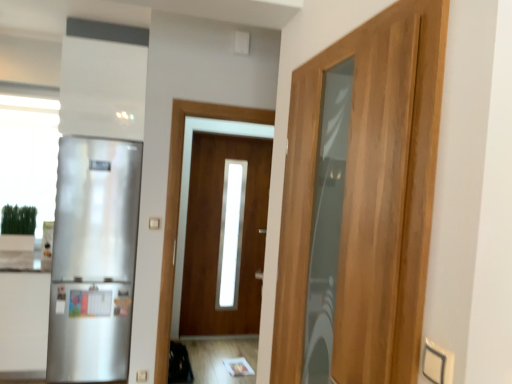
Question: Should I look upward or downward to see satin white cabinet at left?

Choices:
 (A) down
 (B) up

Answer: (A)

Question: Is the depth of satin silver refrigerator at left greater than that of wooden door at center, acting as the second door starting from the right?

Choices:
 (A) yes
 (B) no

Answer: (B)

Question: From the image's perspective, is satin silver refrigerator at left above wooden door at center, the second door when ordered from front to back?

Choices:
 (A) yes
 (B) no

Answer: (B)

Question: Is wooden door at center, the second door when ordered from front to back, at the back of satin silver refrigerator at left?

Choices:
 (A) yes
 (B) no

Answer: (B)

Question: Does satin silver refrigerator at left turn towards wooden door at center, the second door when ordered from front to back?

Choices:
 (A) no
 (B) yes

Answer: (A)

Question: From the image's perspective, is satin silver refrigerator at left located beneath wooden door at center, the 1th door positioned from the left?

Choices:
 (A) yes
 (B) no

Answer: (A)

Question: Is satin silver refrigerator at left wider than wooden door at center, which is counted as the first door, starting from the back?

Choices:
 (A) no
 (B) yes

Answer: (B)

Question: From the image's perspective, is wooden door at center, which is counted as the first door, starting from the back, above satin white cabinet at left?

Choices:
 (A) no
 (B) yes

Answer: (B)

Question: Can you confirm if wooden door at center, which is counted as the first door, starting from the back, is thinner than satin white cabinet at left?

Choices:
 (A) yes
 (B) no

Answer: (A)

Question: Is wooden door at center, the 1th door positioned from the left, further to camera compared to satin white cabinet at left?

Choices:
 (A) no
 (B) yes

Answer: (B)

Question: Considering the relative positions of wooden door at center, the second door when ordered from front to back, and satin white cabinet at left in the image provided, is wooden door at center, the second door when ordered from front to back, to the left of satin white cabinet at left from the viewer's perspective?

Choices:
 (A) yes
 (B) no

Answer: (B)

Question: Is wooden door at center, the second door when ordered from front to back, positioned beyond the bounds of satin white cabinet at left?

Choices:
 (A) yes
 (B) no

Answer: (A)

Question: From the image's perspective, is wooden door at center, acting as the second door starting from the right, under satin white cabinet at left?

Choices:
 (A) yes
 (B) no

Answer: (B)

Question: Does satin silver refrigerator at left have a larger size compared to wooden door at right, the second door viewed from the left?

Choices:
 (A) yes
 (B) no

Answer: (A)